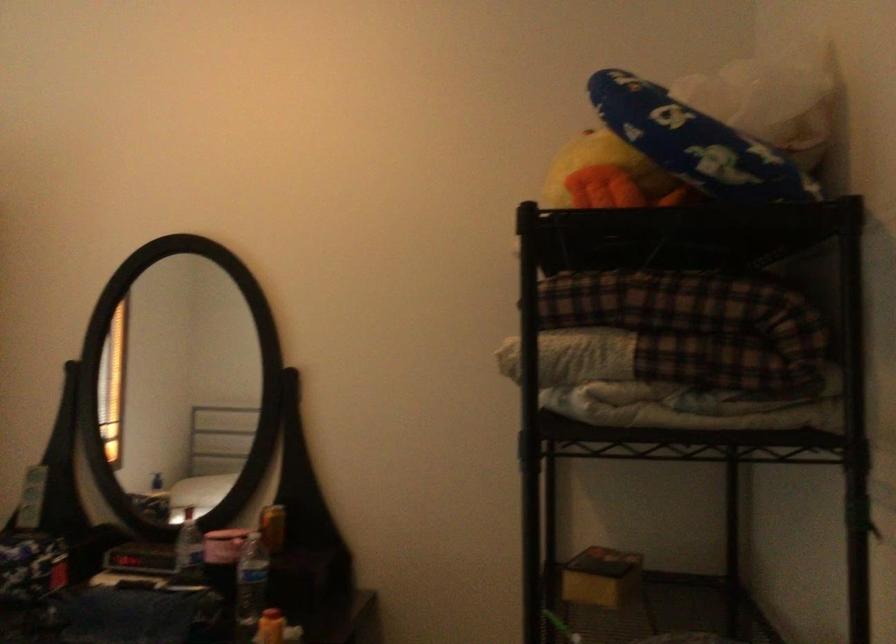
Find the location of `yellow stuffed duck`. yellow stuffed duck is located at coordinates pos(606,176).